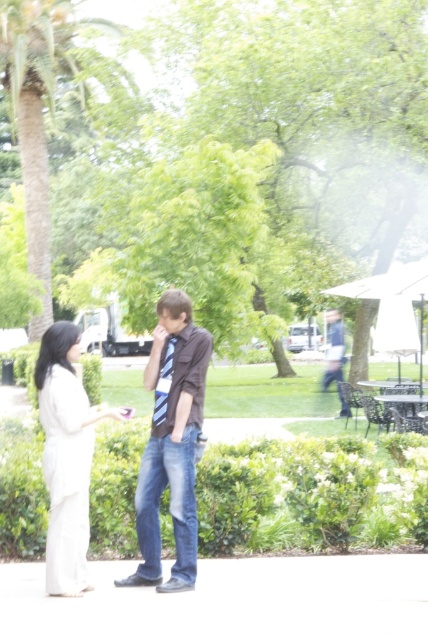
Who is taller, white matte dress at left or blue jeans at center?

With more height is blue jeans at center.

Is white matte dress at left positioned at the back of blue jeans at center?

That is False.

At what (x,y) coordinates should I click in order to perform the action: click on white matte dress at left. Please return your answer as a coordinate pair (x, y). The height and width of the screenshot is (640, 428). Looking at the image, I should click on (65, 458).

At what (x,y) coordinates should I click in order to perform the action: click on white matte dress at left. Please return your answer as a coordinate pair (x, y). Looking at the image, I should click on (65, 458).

Is dark brown shirt at center taller than green leafy palm tree at left?

No, dark brown shirt at center is not taller than green leafy palm tree at left.

Does point (187, 442) lie behind point (20, 161)?

That is False.

Where is `dark brown shirt at center`? The image size is (428, 640). dark brown shirt at center is located at coordinates (172, 444).

This screenshot has height=640, width=428. I want to click on dark brown shirt at center, so click(172, 444).

This screenshot has width=428, height=640. I want to click on dark brown shirt at center, so click(x=172, y=444).

At what (x,y) coordinates should I click in order to perform the action: click on dark brown shirt at center. Please return your answer as a coordinate pair (x, y). The height and width of the screenshot is (640, 428). Looking at the image, I should click on point(172,444).